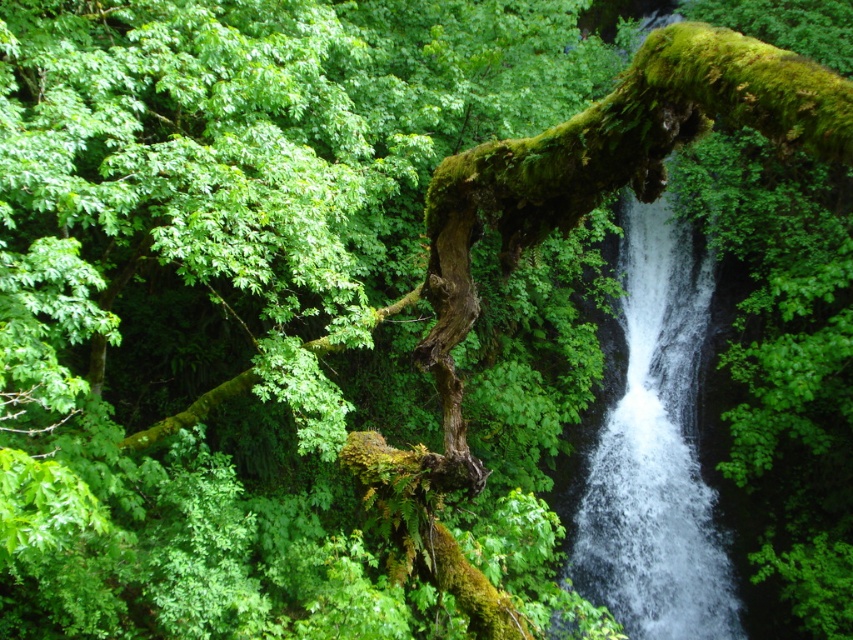
Between green mossy branch at center and white frothy water at center, which one has more height?

Standing taller between the two is white frothy water at center.

Looking at this image, does green mossy branch at center lie in front of white frothy water at center?

That is True.

Is point (485, 186) positioned after point (625, 625)?

No.

Where is `green mossy branch at center`? The image size is (853, 640). green mossy branch at center is located at coordinates (606, 173).